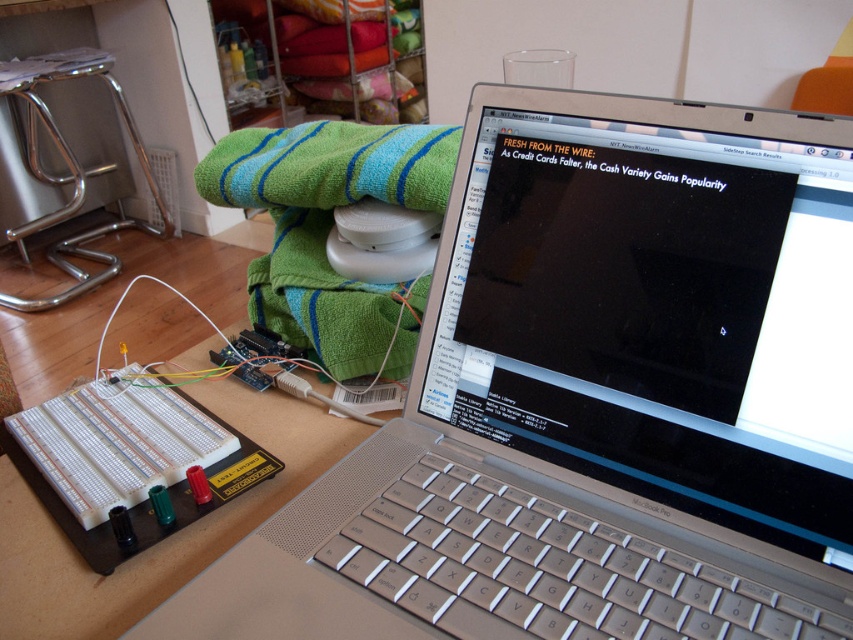
Question: Does green striped towel at upper center appear over white plastic breadboard at lower left?

Choices:
 (A) yes
 (B) no

Answer: (A)

Question: From the image, what is the correct spatial relationship of silver metallic laptop at center in relation to green striped towel at upper center?

Choices:
 (A) right
 (B) left

Answer: (A)

Question: Does green striped towel at upper center appear over white plastic breadboard at lower left?

Choices:
 (A) yes
 (B) no

Answer: (A)

Question: Among these objects, which one is nearest to the camera?

Choices:
 (A) silver metallic laptop at center
 (B) green striped towel at upper center
 (C) white plastic breadboard at lower left

Answer: (A)

Question: Which point appears closest to the camera in this image?

Choices:
 (A) (234, 531)
 (B) (194, 628)
 (C) (386, 172)

Answer: (B)

Question: Among these objects, which one is nearest to the camera?

Choices:
 (A) white plastic breadboard at lower left
 (B) silver metallic laptop at center

Answer: (B)